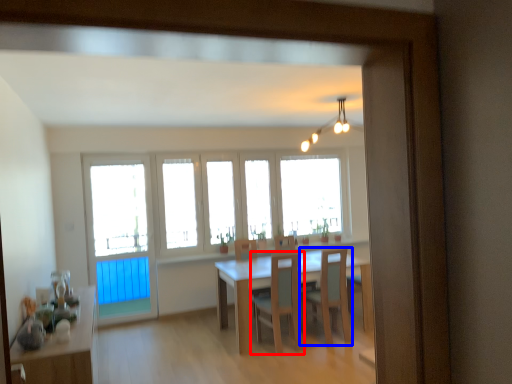
Question: Among these objects, which one is nearest to the camera, chair (highlighted by a red box) or chair (highlighted by a blue box)?

Choices:
 (A) chair
 (B) chair

Answer: (A)